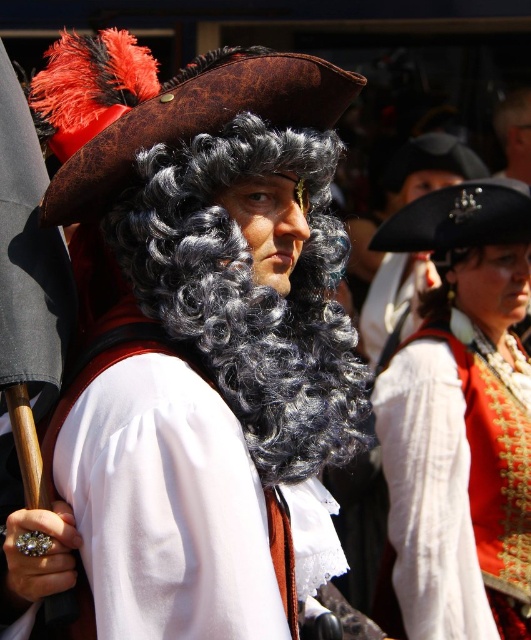
Question: Is curly black wig at center to the left of white satin vest at center from the viewer's perspective?

Choices:
 (A) no
 (B) yes

Answer: (B)

Question: Is white satin vest at center positioned in front of black curly wig at upper right?

Choices:
 (A) no
 (B) yes

Answer: (B)

Question: Which point appears closest to the camera in this image?

Choices:
 (A) (422, 316)
 (B) (466, 390)
 (C) (261, 289)

Answer: (C)

Question: Which of the following is the farthest from the observer?

Choices:
 (A) white satin vest at center
 (B) curly black wig at center

Answer: (A)

Question: Which point appears farthest from the camera in this image?

Choices:
 (A) (447, 326)
 (B) (451, 326)

Answer: (A)

Question: Is white satin vest at center bigger than black curly wig at upper right?

Choices:
 (A) no
 (B) yes

Answer: (B)